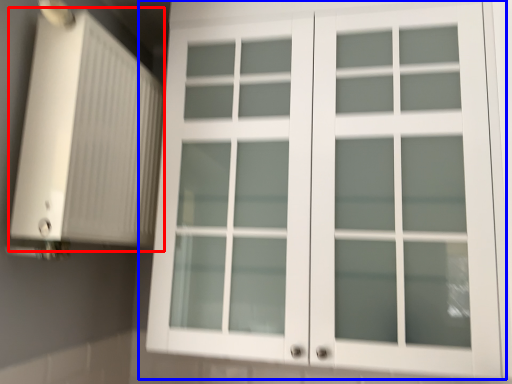
Question: Which point is further to the camera, air conditioning (highlighted by a red box) or cupboard (highlighted by a blue box)?

Choices:
 (A) air conditioning
 (B) cupboard

Answer: (B)